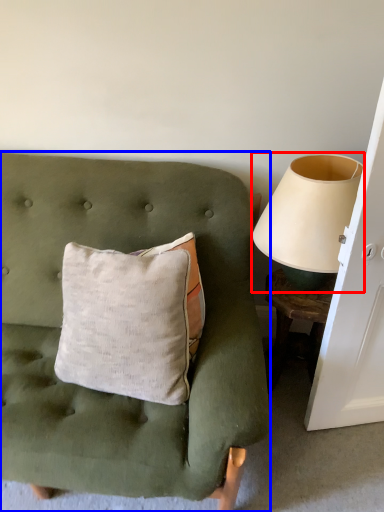
Question: Which object appears farthest to the camera in this image, table lamp (highlighted by a red box) or furniture (highlighted by a blue box)?

Choices:
 (A) table lamp
 (B) furniture

Answer: (A)